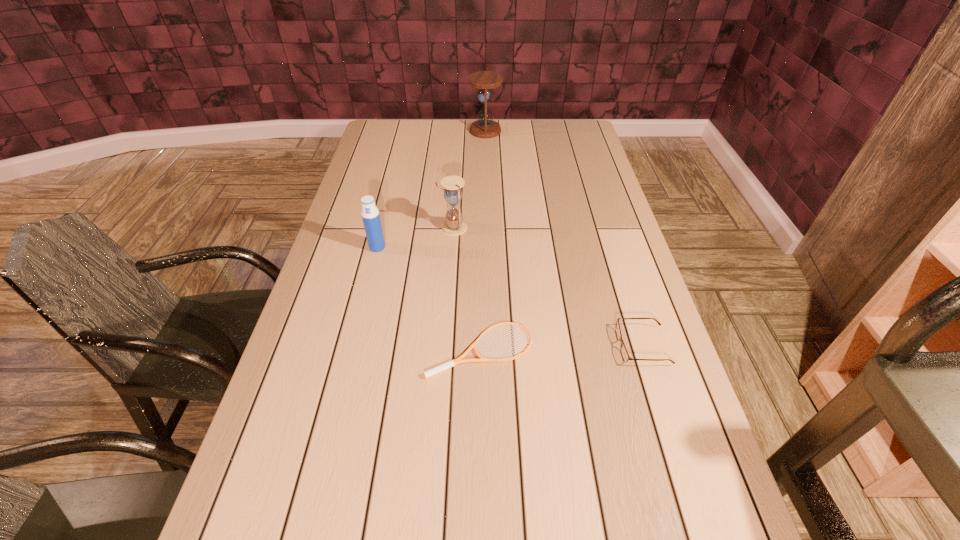
Where is `the farther hourglass`? Image resolution: width=960 pixels, height=540 pixels. the farther hourglass is located at coordinates (485, 127).

Identify the location of the fourth nearest object. (454, 225).

The image size is (960, 540). Identify the location of the third nearest object. (370, 214).

Image resolution: width=960 pixels, height=540 pixels. Find the location of `the leftmost object`. the leftmost object is located at coordinates (370, 214).

Where is `the fourth tallest object`? This screenshot has height=540, width=960. the fourth tallest object is located at coordinates (625, 356).

This screenshot has height=540, width=960. Identify the location of the rightmost object. (625, 356).

The image size is (960, 540). What are the coordinates of `tennis racket` in the screenshot? It's located at (459, 360).

Locate an element on the screen. Image resolution: width=960 pixels, height=540 pixels. vacant region located 0.130m on the front of the farthest object is located at coordinates (486, 155).

Where is `vacant space positioned 0.150m on the left of the fourth nearest object`? Image resolution: width=960 pixels, height=540 pixels. vacant space positioned 0.150m on the left of the fourth nearest object is located at coordinates (392, 228).

Where is `vacant space located on the back of the water bottle`? This screenshot has width=960, height=540. vacant space located on the back of the water bottle is located at coordinates (390, 197).